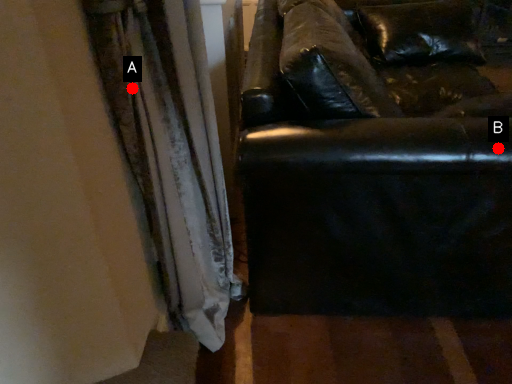
Question: Two points are circled on the image, labeled by A and B beside each circle. Which of the following is the farthest from the observer?

Choices:
 (A) A is further
 (B) B is further

Answer: (B)